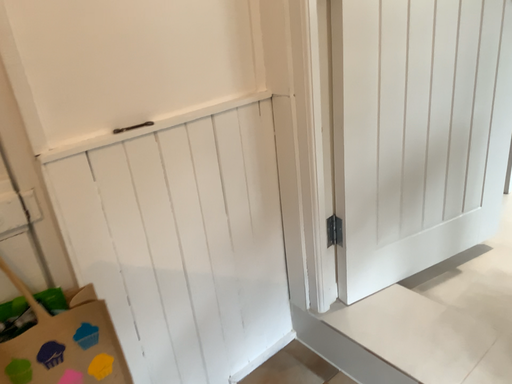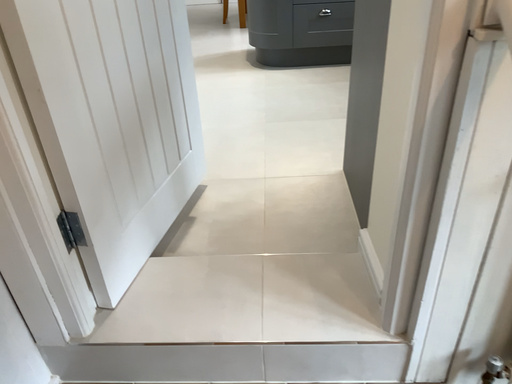
Question: How did the camera likely rotate when shooting the video?

Choices:
 (A) rotated left
 (B) rotated right

Answer: (B)